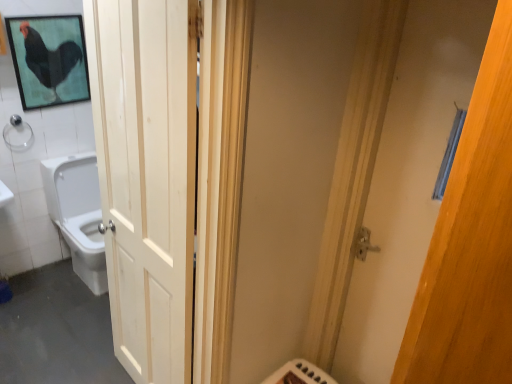
Question: Is wooden door at right, arranged as the first door when viewed from the right, placed right next to white glossy toilet at left?

Choices:
 (A) yes
 (B) no

Answer: (B)

Question: From the image's perspective, is wooden door at right, which ranks as the 2th door in left-to-right order, located beneath white glossy toilet at left?

Choices:
 (A) no
 (B) yes

Answer: (A)

Question: From the image's perspective, is wooden door at right, arranged as the first door when viewed from the right, over white glossy toilet at left?

Choices:
 (A) no
 (B) yes

Answer: (B)

Question: From a real-world perspective, is wooden door at right, which ranks as the 2th door in left-to-right order, beneath white glossy toilet at left?

Choices:
 (A) yes
 (B) no

Answer: (B)

Question: Considering the relative sizes of wooden door at right, which ranks as the 2th door in left-to-right order, and white glossy toilet at left in the image provided, is wooden door at right, which ranks as the 2th door in left-to-right order, shorter than white glossy toilet at left?

Choices:
 (A) yes
 (B) no

Answer: (B)

Question: Would you say white glossy toilet at left is part of wooden door at right, which ranks as the 2th door in left-to-right order,'s contents?

Choices:
 (A) no
 (B) yes

Answer: (A)

Question: Does black matte chicken at upper left come in front of white wood door at left, the 1th door viewed from the left?

Choices:
 (A) yes
 (B) no

Answer: (B)

Question: Is white wood door at left, placed as the second door when sorted from right to left, located within black matte chicken at upper left?

Choices:
 (A) no
 (B) yes

Answer: (A)

Question: Can we say black matte chicken at upper left lies outside white wood door at left, placed as the second door when sorted from right to left?

Choices:
 (A) yes
 (B) no

Answer: (A)

Question: Is black matte chicken at upper left oriented away from white wood door at left, placed as the second door when sorted from right to left?

Choices:
 (A) no
 (B) yes

Answer: (A)

Question: Is black matte chicken at upper left facing towards white wood door at left, placed as the second door when sorted from right to left?

Choices:
 (A) no
 (B) yes

Answer: (B)

Question: Is the position of black matte chicken at upper left more distant than that of white wood door at left, the 1th door viewed from the left?

Choices:
 (A) no
 (B) yes

Answer: (B)

Question: Are white wood door at left, placed as the second door when sorted from right to left, and wooden door at right, arranged as the first door when viewed from the right, far apart?

Choices:
 (A) no
 (B) yes

Answer: (B)